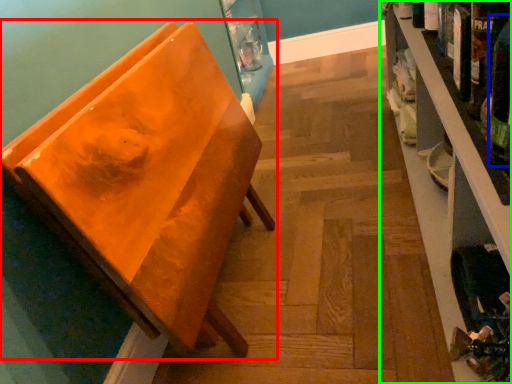
Question: Which is farther away from furniture (highlighted by a red box)? beer bottle (highlighted by a blue box) or shelf (highlighted by a green box)?

Choices:
 (A) beer bottle
 (B) shelf

Answer: (A)